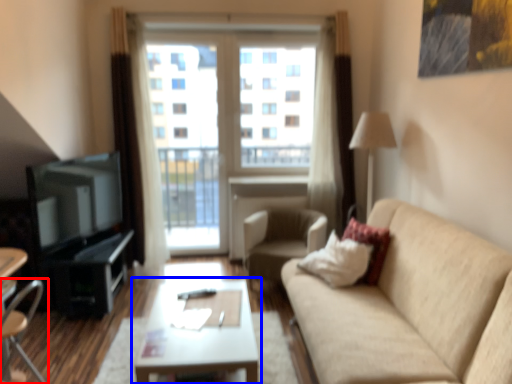
Question: Which object appears closest to the camera in this image, chair (highlighted by a red box) or coffee table (highlighted by a blue box)?

Choices:
 (A) chair
 (B) coffee table

Answer: (A)